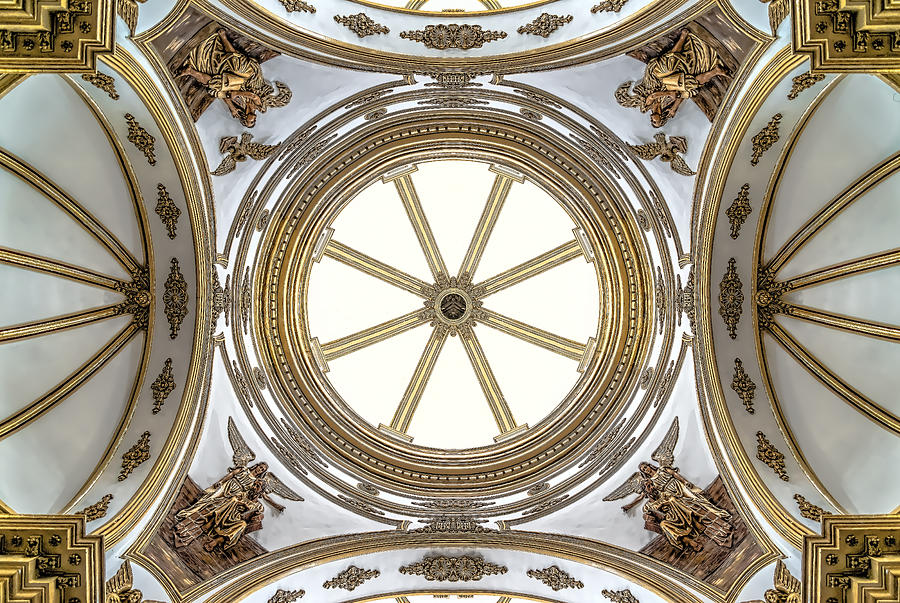
Where is `rosette`? The height and width of the screenshot is (603, 900). rosette is located at coordinates (177, 295).